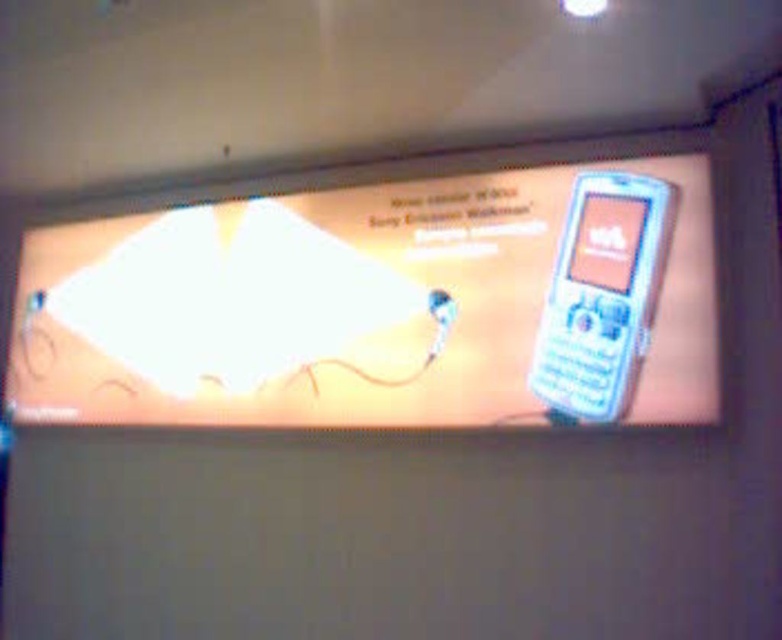
How distant is white plastic phone at center from white plastic phone at right?

They are 18.95 inches apart.

Does white plastic phone at center appear under white plastic phone at right?

No.

Is point (436, 358) in front of point (619, 257)?

That is False.

Image resolution: width=782 pixels, height=640 pixels. Identify the location of white plastic phone at center. (382, 304).